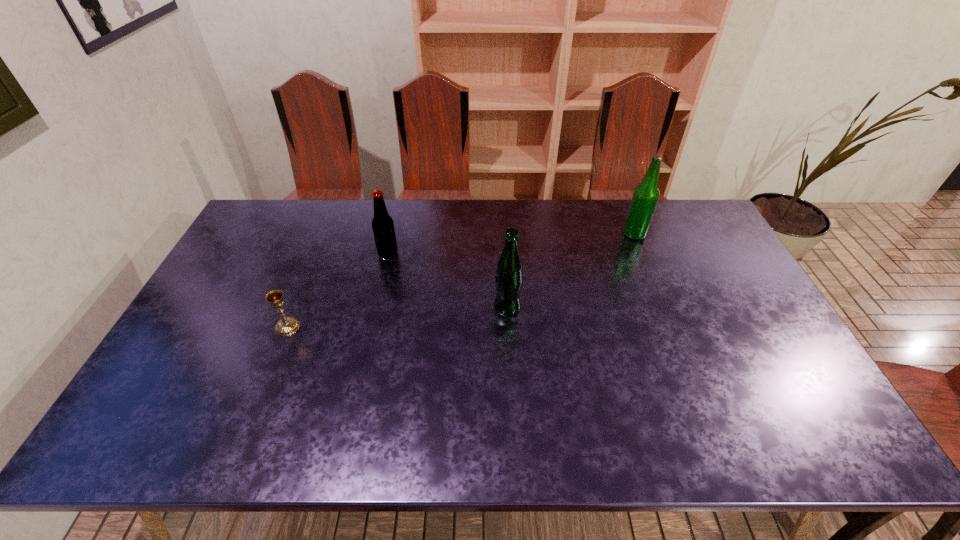
At what (x,y) coordinates should I click in order to perform the action: click on free location located 0.110m on the label of the rightmost object. Please return your answer as a coordinate pair (x, y). The width and height of the screenshot is (960, 540). Looking at the image, I should click on (591, 234).

Image resolution: width=960 pixels, height=540 pixels. I want to click on free space located 0.170m on the back of the second object from right to left, so click(x=504, y=260).

Image resolution: width=960 pixels, height=540 pixels. What are the coordinates of `free space located 0.340m on the right of the shortest beer bottle` in the screenshot? It's located at (501, 254).

The width and height of the screenshot is (960, 540). What are the coordinates of `vacant space situated 0.260m on the front of the chalice` in the screenshot? It's located at (248, 424).

This screenshot has height=540, width=960. In order to click on object at the far edge in this screenshot , I will do `click(646, 195)`.

Find the location of a particular element. This screenshot has height=540, width=960. free location at the far edge is located at coordinates [x=627, y=202].

Locate an element on the screen. The height and width of the screenshot is (540, 960). vacant region at the near edge of the desktop is located at coordinates (596, 438).

In the image, there is a desktop. What are the coordinates of `vacant space at the left edge` in the screenshot? It's located at (221, 269).

You are a GUI agent. You are given a task and a screenshot of the screen. Output one action in this format:
    pyautogui.click(x=<x>, y=<y>)
    Task: Click on the vacant space at the right edge of the desktop
    
    Given the screenshot: What is the action you would take?
    pyautogui.click(x=803, y=398)

The width and height of the screenshot is (960, 540). In the image, there is a desktop. What are the coordinates of `vacant space at the far left corner` in the screenshot? It's located at (286, 226).